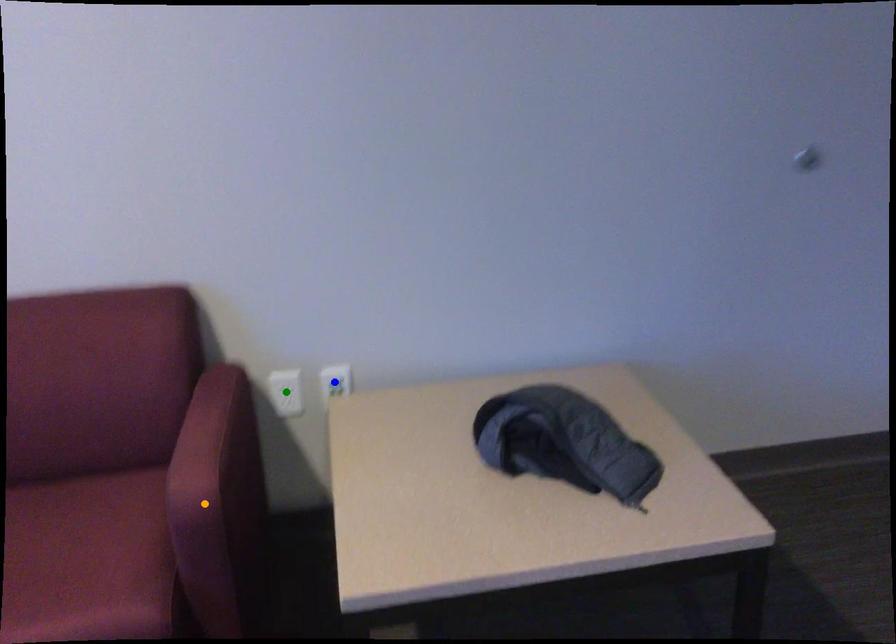
Order these from nearest to farthest:
green point, orange point, blue point

1. blue point
2. green point
3. orange point